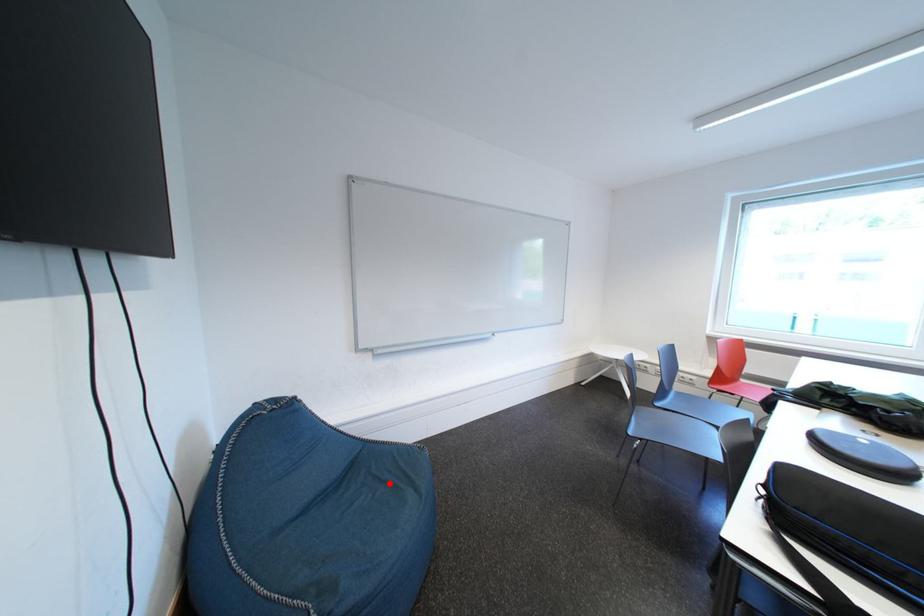
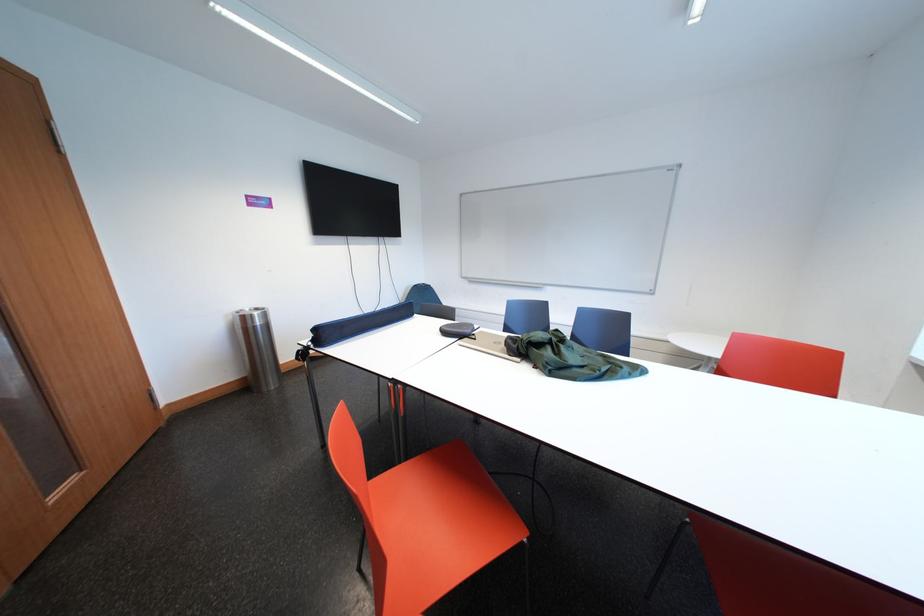
Question: I am providing you with two images of the same scene from different viewpoints. A red point is marked on the first image. At the location where the point appears in image 1, is it still visible in image 2?

Choices:
 (A) Yes
 (B) No

Answer: (B)